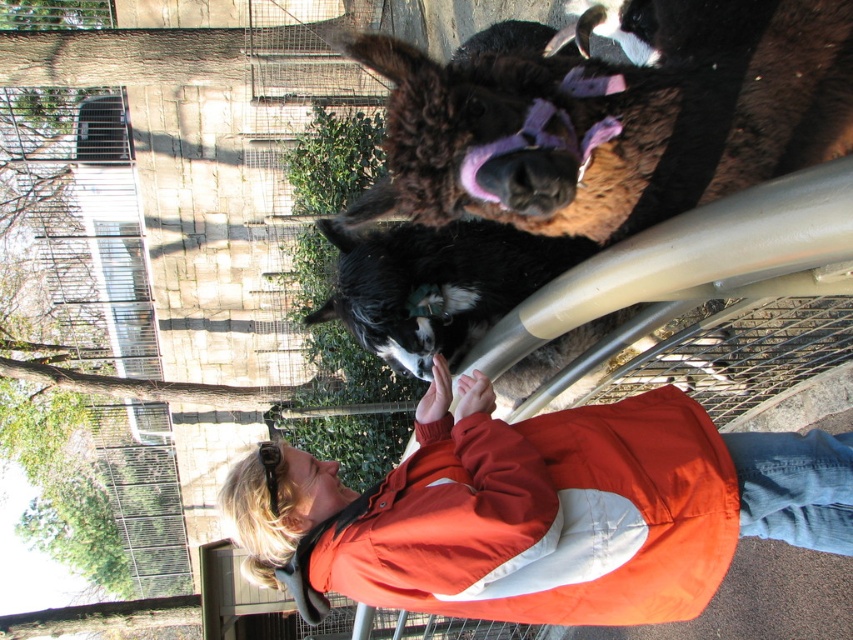
Image resolution: width=853 pixels, height=640 pixels. Describe the element at coordinates (543, 509) in the screenshot. I see `orange fabric jacket at upper center` at that location.

Which is in front, point (572, 467) or point (682, 164)?

Point (682, 164)

The height and width of the screenshot is (640, 853). I want to click on orange fabric jacket at upper center, so click(543, 509).

Who is lower down, brown fuzzy donkey at upper center or black fur dog at center?

Positioned lower is black fur dog at center.

Can you confirm if brown fuzzy donkey at upper center is positioned above black fur dog at center?

Indeed, brown fuzzy donkey at upper center is positioned over black fur dog at center.

What do you see at coordinates (614, 118) in the screenshot? I see `brown fuzzy donkey at upper center` at bounding box center [614, 118].

Identify the location of brown fuzzy donkey at upper center. pos(614,118).

Describe the element at coordinates (543, 509) in the screenshot. The width and height of the screenshot is (853, 640). I see `orange fabric jacket at upper center` at that location.

Who is positioned more to the right, orange fabric jacket at upper center or black fur dog at center?

From the viewer's perspective, orange fabric jacket at upper center appears more on the right side.

Between point (494, 449) and point (595, 378), which one is positioned behind?

The point (595, 378) is more distant.

Where is `orange fabric jacket at upper center`? The height and width of the screenshot is (640, 853). orange fabric jacket at upper center is located at coordinates (543, 509).